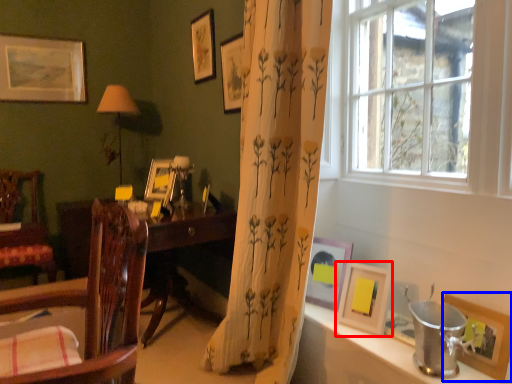
Question: Among these objects, which one is farthest to the camera, picture frame (highlighted by a red box) or picture frame (highlighted by a blue box)?

Choices:
 (A) picture frame
 (B) picture frame

Answer: (A)